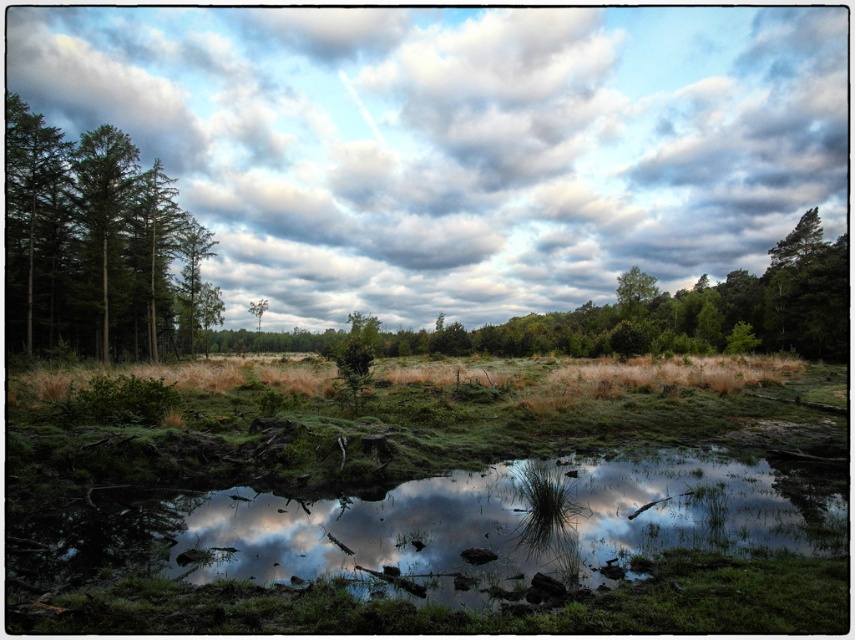
Question: Among these objects, which one is nearest to the camera?

Choices:
 (A) cloudy sky at upper center
 (B) green leafy tree at upper center
 (C) green matte tree at left
 (D) transparent water at center

Answer: (D)

Question: Which of the following is the farthest from the observer?

Choices:
 (A) (x=582, y=483)
 (B) (x=74, y=186)
 (C) (x=52, y=198)
 (D) (x=640, y=314)

Answer: (D)

Question: Which is nearer to the green matte tree at left?

Choices:
 (A) cloudy sky at upper center
 (B) transparent water at center
 (C) green matte trees at left
 (D) green leafy tree at upper center

Answer: (C)

Question: Where is green matte trees at left located in relation to green matte tree at left in the image?

Choices:
 (A) above
 (B) below

Answer: (B)

Question: Is cloudy sky at upper center below transparent water at center?

Choices:
 (A) no
 (B) yes

Answer: (A)

Question: Is green matte tree at left in front of green leafy tree at upper center?

Choices:
 (A) no
 (B) yes

Answer: (B)